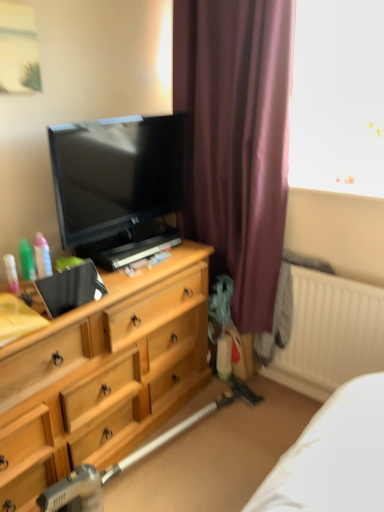
At what (x,y) coordinates should I click in order to perform the action: click on vacant region to the right of translucent plastic bottles at left, the first toiletry from the right. Please return your answer as a coordinate pair (x, y). The height and width of the screenshot is (512, 384). Looking at the image, I should click on (100, 287).